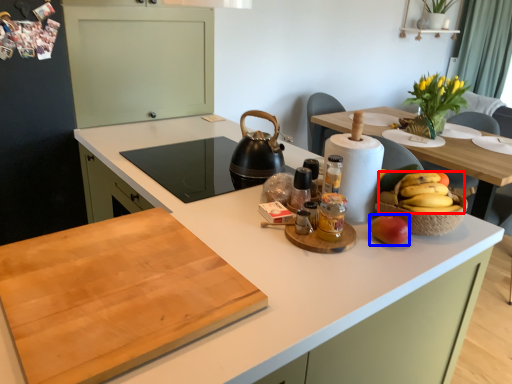
Question: Among these objects, which one is farthest to the camera, grapefruit (highlighted by a red box) or apple (highlighted by a blue box)?

Choices:
 (A) grapefruit
 (B) apple

Answer: (A)